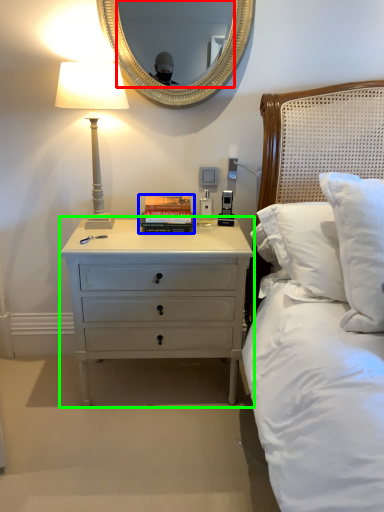
Question: Which object is the farthest from mirror (highlighted by a red box)? Choose among these: paperback book (highlighted by a blue box) or nightstand (highlighted by a green box).

Choices:
 (A) paperback book
 (B) nightstand

Answer: (B)